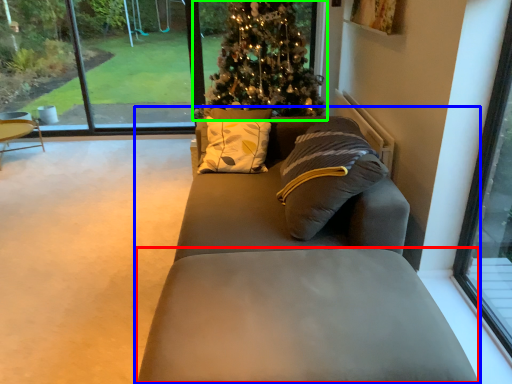
Question: Based on their relative distances, which object is farther from footrest (highlighted by a red box)? Choose from studio couch (highlighted by a blue box) and christmas tree (highlighted by a green box).

Choices:
 (A) studio couch
 (B) christmas tree

Answer: (B)